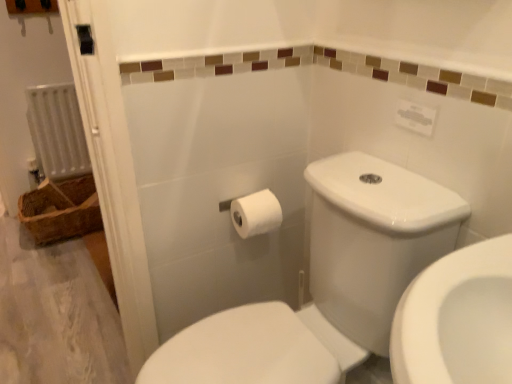
Question: From the image's perspective, is white matte toilet paper at center located above or below white glossy toilet at center?

Choices:
 (A) below
 (B) above

Answer: (B)

Question: From a real-world perspective, is white matte toilet paper at center physically located above or below white glossy toilet at center?

Choices:
 (A) above
 (B) below

Answer: (A)

Question: Which object is the farthest from the white glossy toilet at center?

Choices:
 (A) white matte toilet paper at center
 (B) woven brown basket at left
 (C) white plastic radiator at left

Answer: (C)

Question: Which is nearer to the white plastic radiator at left?

Choices:
 (A) white matte toilet paper at center
 (B) white glossy toilet at center
 (C) woven brown basket at left

Answer: (C)